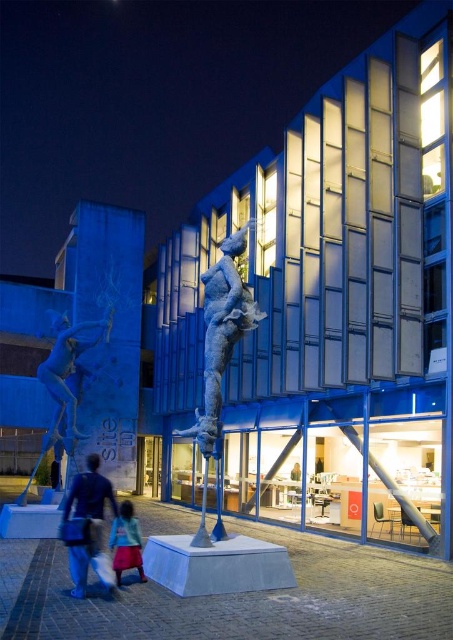
You are an artist planning to photograph the blue metallic statue at left and the blue fabric bag at lower left. You want to ensure both subjects are in frame. Given that your camera has a fixed focal length, which object should you position closer to the camera to maintain their relative sizes as seen in the original scene?

Since the blue metallic statue at left is wider than the blue fabric bag at lower left, you should position the blue metallic statue at left closer to the camera to maintain their relative sizes as seen in the original scene.

You are a photographer standing at the center of the scene. You want to take a photo that includes both the blue metallic statue at left and the blue fabric bag at lower left. Which object should you position closer to the camera to ensure both are in frame?

Since the blue metallic statue at left is much taller than the blue fabric bag at lower left, you should position the blue metallic statue at left closer to the camera to ensure both are in frame.

You are a photographer setting up equipment for an event at the modern architectural structure. You have a blue metallic statue at center and a blue fabric bag at lower left in your shot. Which object should you focus on first if you want to capture the tallest object in the scene?

The blue metallic statue at center should be focused on first because it has a greater height compared to the blue fabric bag at lower left.